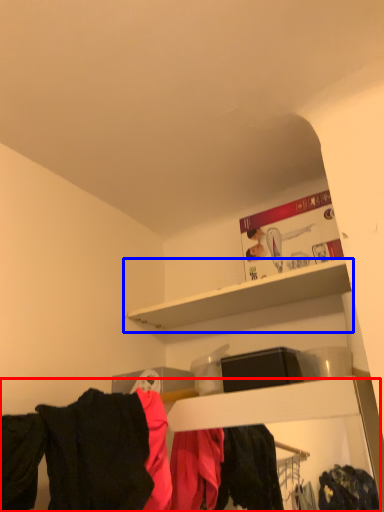
Question: Which point is closer to the camera, closet (highlighted by a red box) or shelf (highlighted by a blue box)?

Choices:
 (A) closet
 (B) shelf

Answer: (A)